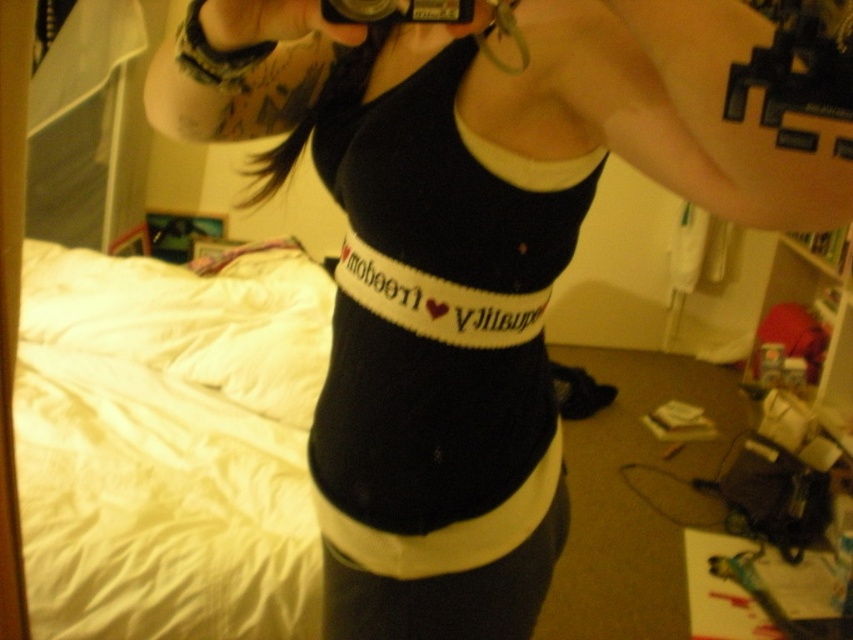
Question: Which object appears farthest from the camera in this image?

Choices:
 (A) black knitted belt at center
 (B) white cotton bed at left
 (C) black plastic camera at upper center

Answer: (B)

Question: Which of the following is the farthest from the observer?

Choices:
 (A) pos(215,612)
 (B) pos(486,557)
 (C) pos(344,4)

Answer: (A)

Question: Does white cotton bed at left appear over black knitted belt at center?

Choices:
 (A) yes
 (B) no

Answer: (A)

Question: Is black knitted belt at center positioned in front of black plastic camera at upper center?

Choices:
 (A) no
 (B) yes

Answer: (A)

Question: Is black knitted belt at center bigger than black plastic camera at upper center?

Choices:
 (A) yes
 (B) no

Answer: (A)

Question: Which point appears farthest from the camera in this image?

Choices:
 (A) (531, 524)
 (B) (347, 4)
 (C) (328, 337)

Answer: (C)